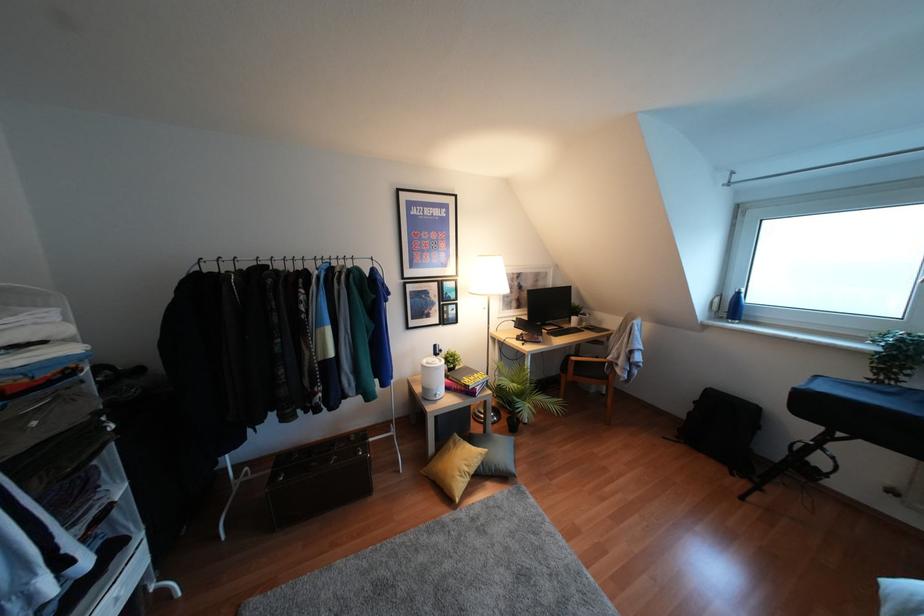
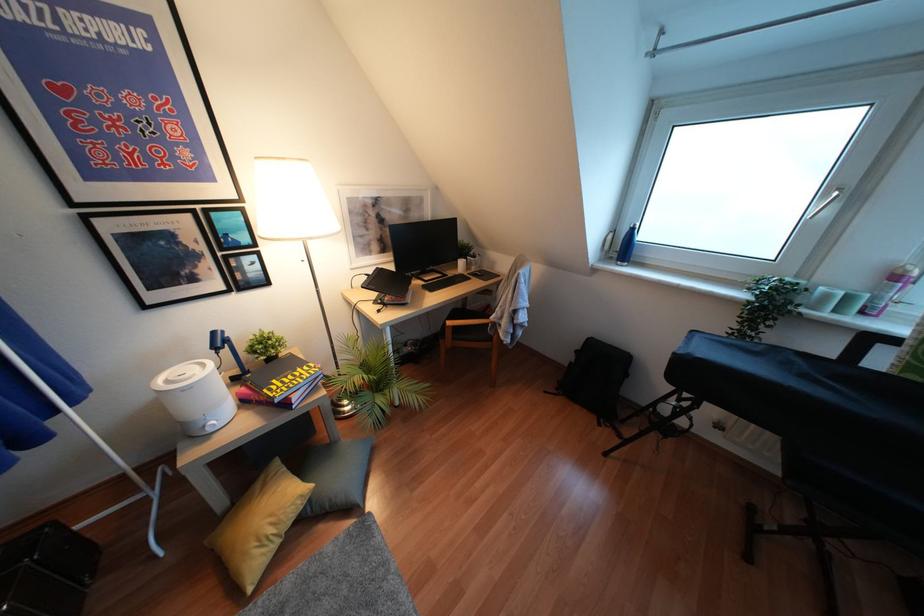
Where in the second image is the point corresponding to point (732, 308) from the first image?

(623, 246)